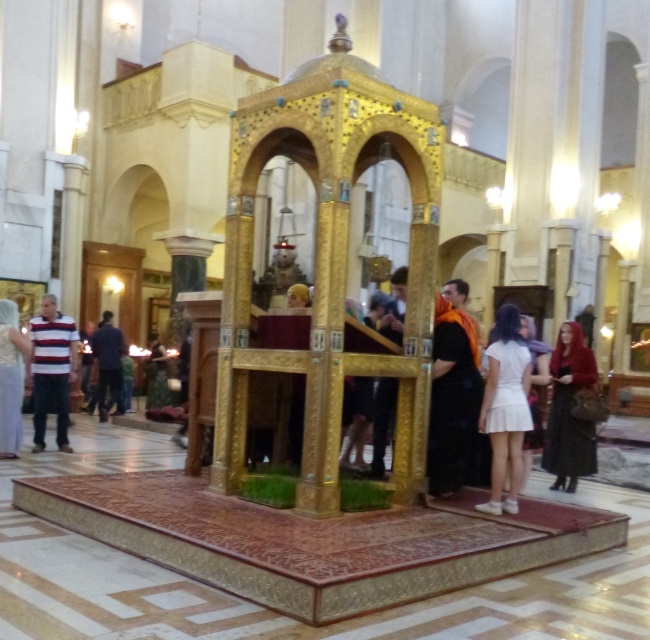
Question: Which object is farther from the camera taking this photo?

Choices:
 (A) white matte skirt at center
 (B) dark blue fabric at left
 (C) light blue lace dress at lower left

Answer: (B)

Question: Which object is farther from the camera taking this photo?

Choices:
 (A) striped fabric shirt at left
 (B) dark blue fabric at left

Answer: (B)

Question: Is striped fabric shirt at left wider than light blue lace dress at lower left?

Choices:
 (A) no
 (B) yes

Answer: (B)

Question: Does light blue lace dress at lower left lie in front of dark blue fabric at left?

Choices:
 (A) no
 (B) yes

Answer: (B)

Question: Among these points, which one is farthest from the camera?

Choices:
 (A) (14, 346)
 (B) (92, 349)

Answer: (B)

Question: Considering the relative positions of light blue lace dress at lower left and dark blue fabric at left in the image provided, where is light blue lace dress at lower left located with respect to dark blue fabric at left?

Choices:
 (A) right
 (B) left

Answer: (A)